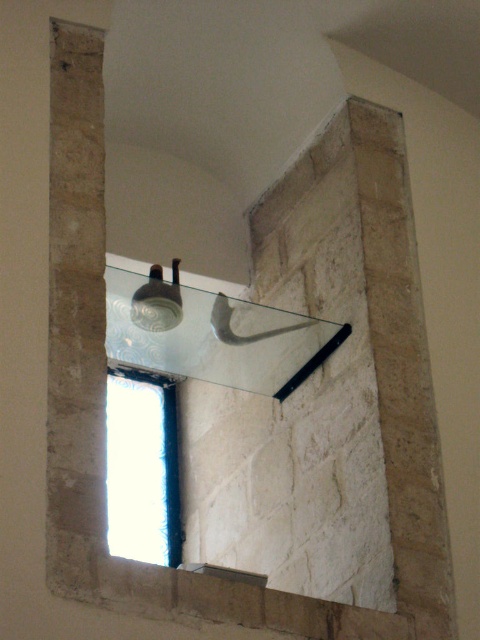
Question: Which of the following is the closest to the observer?

Choices:
 (A) (118, 412)
 (B) (164, 300)

Answer: (B)

Question: Which point appears farthest from the camera in this image?

Choices:
 (A) (235, 310)
 (B) (181, 305)
 (C) (122, 467)

Answer: (C)

Question: Is clear glass mirror at upper center to the left of matte glass lamp at upper center from the viewer's perspective?

Choices:
 (A) yes
 (B) no

Answer: (B)

Question: Which point is closer to the camera taking this photo?

Choices:
 (A) [162, 282]
 (B) [232, 384]

Answer: (A)

Question: In this image, where is clear glass mirror at upper center located relative to transparent glass window at center?

Choices:
 (A) below
 (B) above

Answer: (B)

Question: Is clear glass mirror at upper center bigger than matte glass lamp at upper center?

Choices:
 (A) yes
 (B) no

Answer: (A)